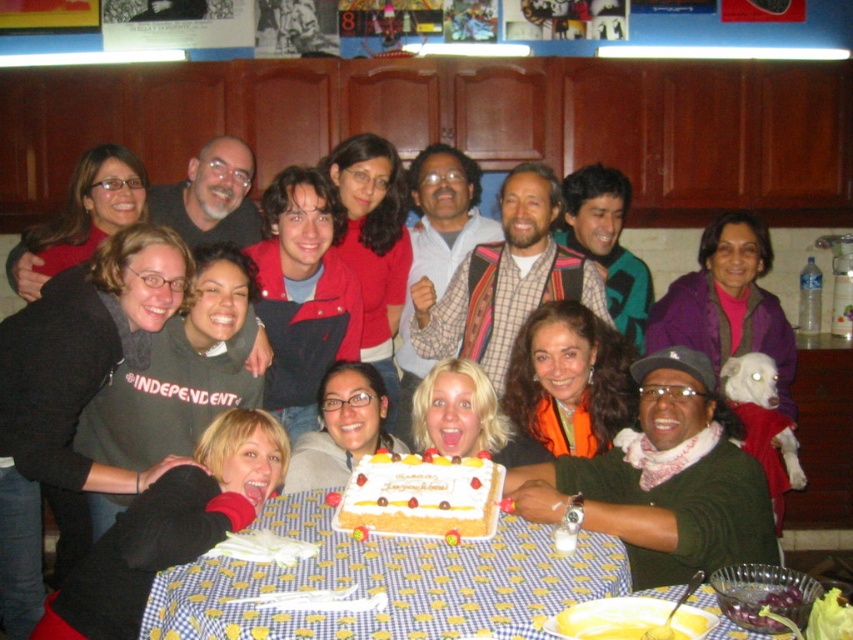
Can you confirm if yellow checkered tablecloth at lower center is positioned to the right of white frosted cake at center?

In fact, yellow checkered tablecloth at lower center is to the left of white frosted cake at center.

Which is more to the left, yellow checkered tablecloth at lower center or white frosted cake at center?

From the viewer's perspective, yellow checkered tablecloth at lower center appears more on the left side.

Does point (294, 509) lie behind point (480, 476)?

Yes, point (294, 509) is behind point (480, 476).

Image resolution: width=853 pixels, height=640 pixels. Identify the location of yellow checkered tablecloth at lower center. (386, 582).